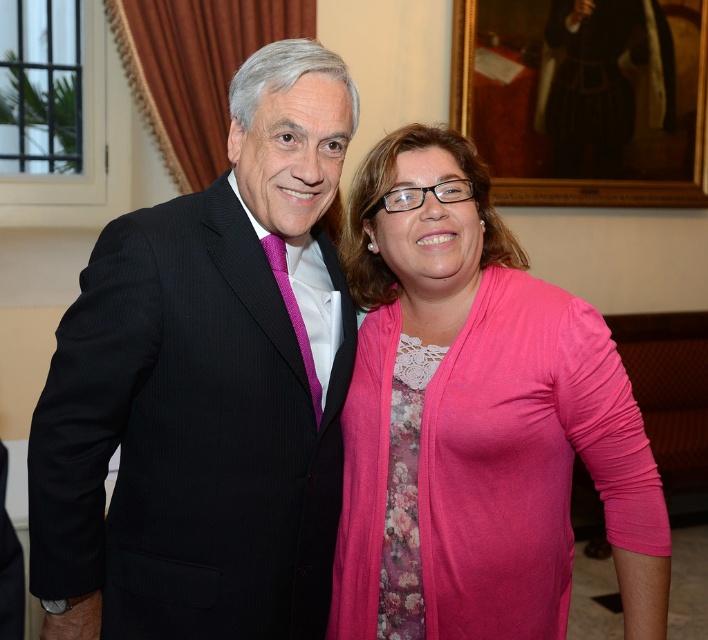
Looking at this image, is black pinstripe suit at center above purple textured tie at center?

Incorrect, black pinstripe suit at center is not positioned above purple textured tie at center.

Measure the distance between point (296, 330) and camera.

Point (296, 330) is 4.41 feet away from camera.

This screenshot has width=708, height=640. In order to click on black pinstripe suit at center in this screenshot , I will do `click(205, 388)`.

Can you confirm if wooden framed portrait at upper center is positioned to the right of purple textured tie at center?

Indeed, wooden framed portrait at upper center is positioned on the right side of purple textured tie at center.

Who is higher up, wooden framed portrait at upper center or purple textured tie at center?

Positioned higher is wooden framed portrait at upper center.

Locate an element on the screen. The image size is (708, 640). wooden framed portrait at upper center is located at coordinates (583, 99).

You are a GUI agent. You are given a task and a screenshot of the screen. Output one action in this format:
    pyautogui.click(x=<x>, y=<y>)
    Task: Click on the wooden framed portrait at upper center
    Image resolution: width=708 pixels, height=640 pixels.
    Given the screenshot: What is the action you would take?
    pyautogui.click(x=583, y=99)

Which is more to the right, black pinstripe suit at center or pink fabric shirt at center?

pink fabric shirt at center

Find the location of a particular element. The image size is (708, 640). black pinstripe suit at center is located at coordinates pyautogui.click(x=205, y=388).